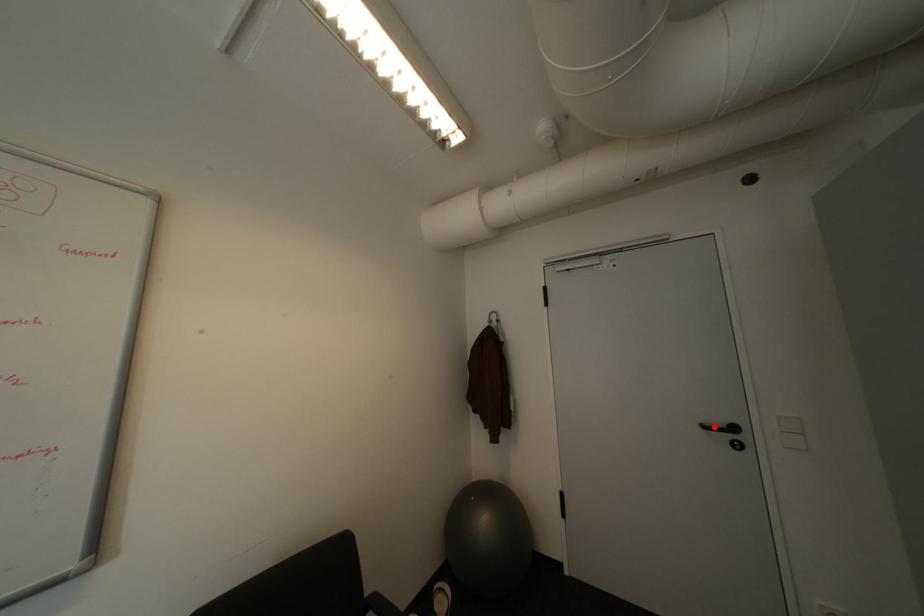
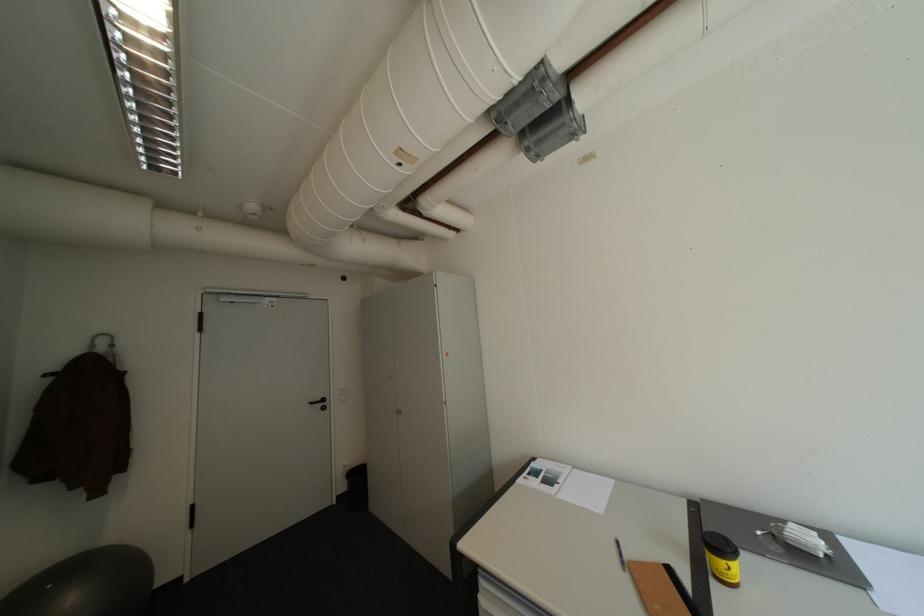
Where in the second image is the point corresponding to the highlighted location from the first image?

(321, 403)